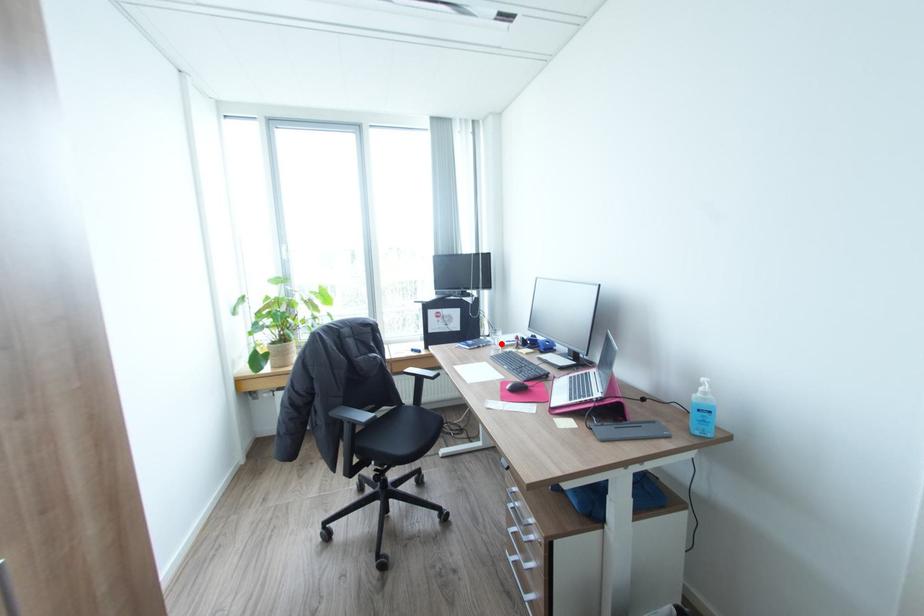
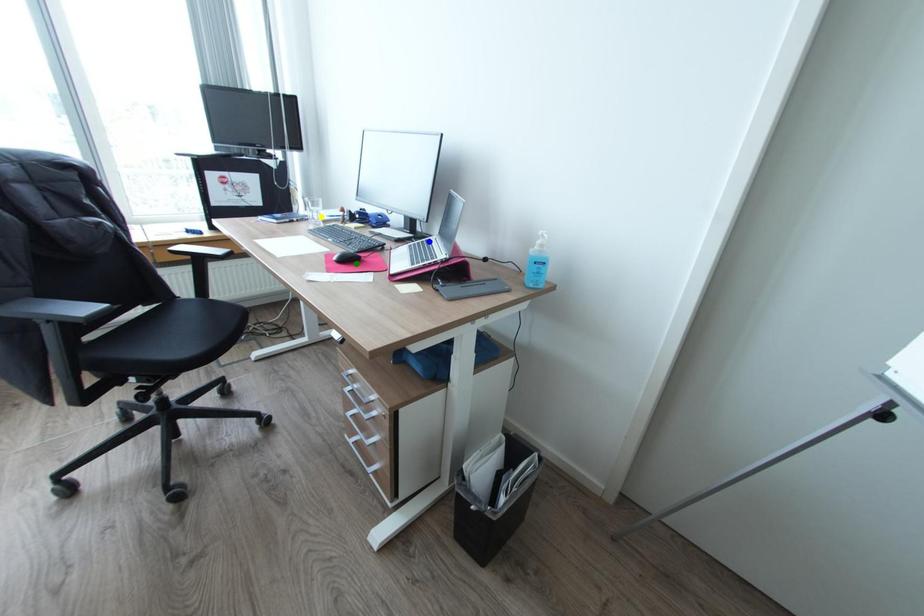
Question: I am providing you with two images of the same scene from different viewpoints. A red point is marked on the first image. You are given multiple points on the second image. Can you choose the point in image 2 that corresponds to the point in image 1?

Choices:
 (A) yellow point
 (B) blue point
 (C) green point

Answer: (A)